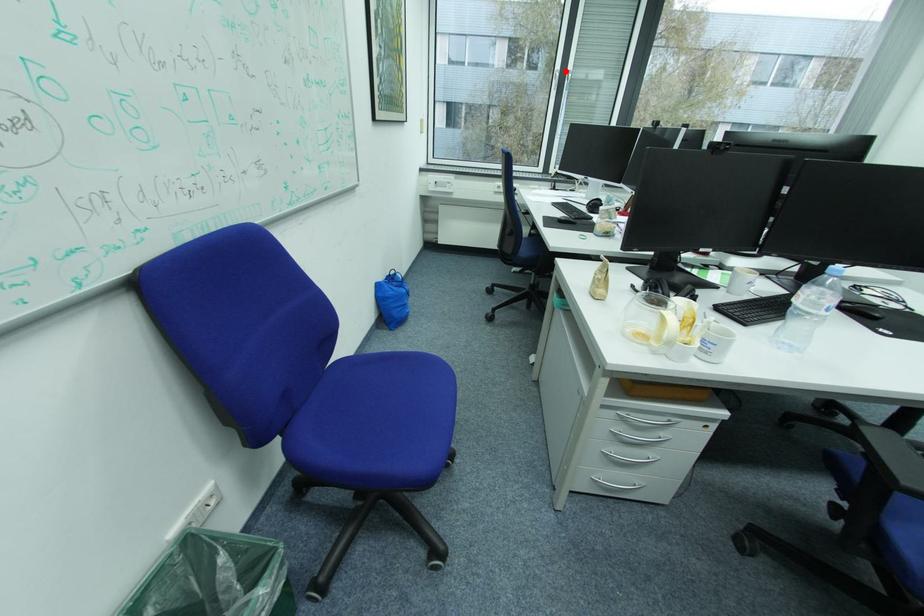
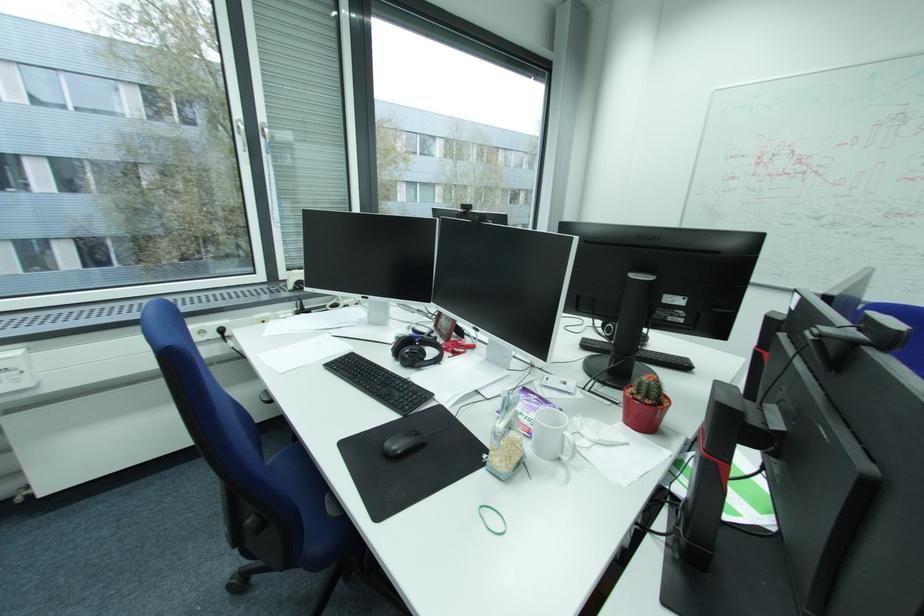
Question: I am providing you with two images of the same scene from different viewpoints. A red point is marked on the first image. Can you still see the location of the red point in image 2?

Choices:
 (A) Yes
 (B) No

Answer: (A)